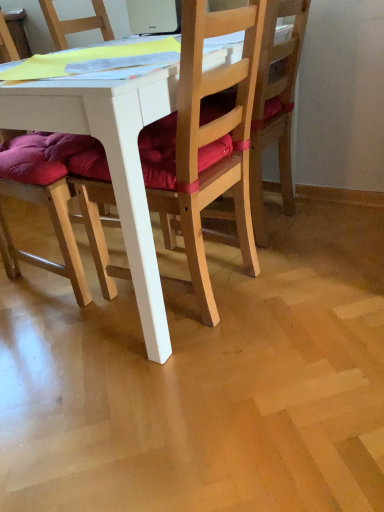
Question: Relative to purple cushioned chair at left, marked as the 3th chair in a right-to-left arrangement, is white plastic laptop at upper center in front or behind?

Choices:
 (A) front
 (B) behind

Answer: (B)

Question: Is white plastic laptop at upper center wider or thinner than purple cushioned chair at left, marked as the 3th chair in a right-to-left arrangement?

Choices:
 (A) thin
 (B) wide

Answer: (A)

Question: Which is nearer to the wooden chair at center, the 1th chair from the right?

Choices:
 (A) white plastic laptop at upper center
 (B) purple cushioned chair at left, arranged as the first chair when viewed from the left
 (C) wooden chair at center, positioned as the second chair in left-to-right order

Answer: (C)

Question: Based on their relative distances, which object is farther from the purple cushioned chair at left, marked as the 3th chair in a right-to-left arrangement?

Choices:
 (A) white plastic laptop at upper center
 (B) wooden chair at center, which is the 3th chair in left-to-right order
 (C) wooden chair at center, which appears as the second chair when viewed from the right

Answer: (A)